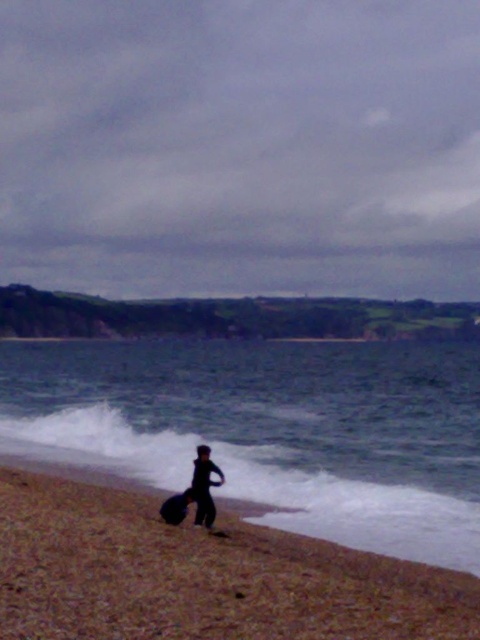
Is brown sandy beach at lower left taller than black matte surfboard at lower center?

In fact, brown sandy beach at lower left may be shorter than black matte surfboard at lower center.

Does point (251, 588) lie behind point (183, 506)?

No, it is not.

Who is more forward, (135, 600) or (187, 506)?

Point (135, 600)

This screenshot has height=640, width=480. Find the location of `brown sandy beach at lower left`. brown sandy beach at lower left is located at coordinates (201, 576).

Is blue water at lower center taller than black matte surfboard at lower center?

Correct, blue water at lower center is much taller as black matte surfboard at lower center.

Measure the distance from blue water at lower center to black matte surfboard at lower center.

blue water at lower center and black matte surfboard at lower center are 49.68 meters apart.

I want to click on blue water at lower center, so click(x=271, y=429).

Does blue water at lower center have a greater height compared to brown sandy beach at lower left?

Indeed, blue water at lower center has a greater height compared to brown sandy beach at lower left.

Does point (265, 406) come in front of point (267, 621)?

That is False.

Is point (477, 384) positioned behind point (396, 580)?

Yes, point (477, 384) is behind point (396, 580).

This screenshot has width=480, height=640. Find the location of `blue water at lower center`. blue water at lower center is located at coordinates (271, 429).